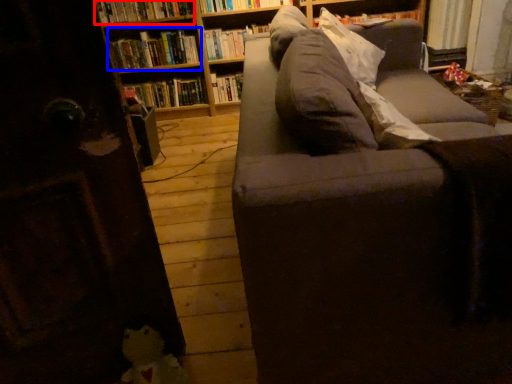
Question: Which object is further to the camera taking this photo, book (highlighted by a red box) or book (highlighted by a blue box)?

Choices:
 (A) book
 (B) book

Answer: (B)